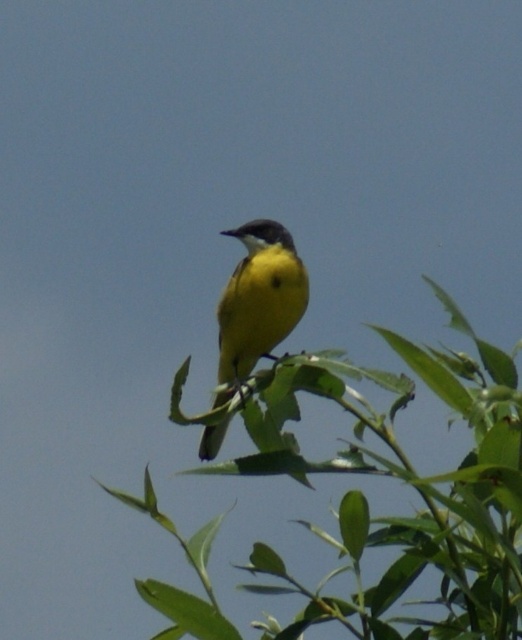
Question: Is green leafy branch at center bigger than yellow matte bird at center?

Choices:
 (A) yes
 (B) no

Answer: (A)

Question: From the image, what is the correct spatial relationship of green leafy branch at center in relation to yellow matte bird at center?

Choices:
 (A) above
 (B) below

Answer: (B)

Question: Does green leafy branch at center have a greater width compared to yellow matte bird at center?

Choices:
 (A) yes
 (B) no

Answer: (A)

Question: Among these objects, which one is nearest to the camera?

Choices:
 (A) green leafy branch at center
 (B) yellow matte bird at center

Answer: (A)

Question: Which point appears closest to the camera in this image?

Choices:
 (A) (476, 595)
 (B) (212, 435)

Answer: (A)